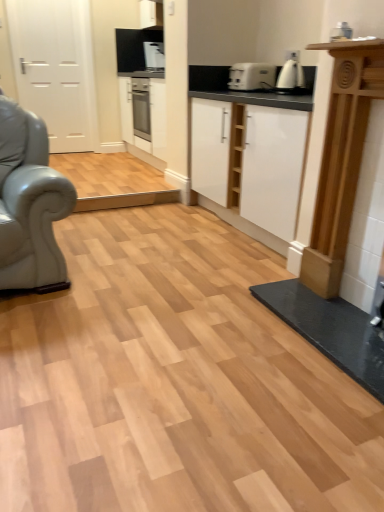
Question: Considering the relative sizes of white glossy kettle at upper right, the first coffee machine from the bottom, and white matte cabinet at center in the image provided, is white glossy kettle at upper right, the first coffee machine from the bottom, taller than white matte cabinet at center?

Choices:
 (A) yes
 (B) no

Answer: (B)

Question: From the image's perspective, does white glossy kettle at upper right, placed as the first coffee machine when sorted from right to left, appear lower than white matte cabinet at center?

Choices:
 (A) no
 (B) yes

Answer: (A)

Question: Is white matte cabinet at center surrounded by white glossy kettle at upper right, the first coffee machine from the bottom?

Choices:
 (A) yes
 (B) no

Answer: (B)

Question: Is white matte cabinet at center at the back of white glossy kettle at upper right, which is counted as the second coffee machine, starting from the top?

Choices:
 (A) no
 (B) yes

Answer: (A)

Question: Is white glossy kettle at upper right, which is counted as the second coffee machine, starting from the top, located outside white matte cabinet at center?

Choices:
 (A) no
 (B) yes

Answer: (B)

Question: Is point (274, 80) positioned closer to the camera than point (278, 177)?

Choices:
 (A) closer
 (B) farther

Answer: (B)

Question: Is white plastic toaster at center bigger or smaller than white matte cabinet at center?

Choices:
 (A) small
 (B) big

Answer: (A)

Question: From the image's perspective, is white plastic toaster at center positioned above or below white matte cabinet at center?

Choices:
 (A) above
 (B) below

Answer: (A)

Question: Considering the positions of white plastic toaster at center and white matte cabinet at center in the image, is white plastic toaster at center taller or shorter than white matte cabinet at center?

Choices:
 (A) short
 (B) tall

Answer: (A)

Question: Is white matte door at left in front of or behind white matte cabinet at center in the image?

Choices:
 (A) front
 (B) behind

Answer: (B)

Question: From the image's perspective, relative to white matte cabinet at center, is white matte door at left above or below?

Choices:
 (A) below
 (B) above

Answer: (B)

Question: In terms of size, does white matte door at left appear bigger or smaller than white matte cabinet at center?

Choices:
 (A) small
 (B) big

Answer: (A)

Question: From their relative heights in the image, would you say white matte door at left is taller or shorter than white matte cabinet at center?

Choices:
 (A) short
 (B) tall

Answer: (B)

Question: Is white glossy kettle at upper right, the first coffee machine from the bottom, situated inside white matte cabinet at center or outside?

Choices:
 (A) outside
 (B) inside

Answer: (A)

Question: Relative to white matte cabinet at center, is white glossy kettle at upper right, acting as the 1th coffee machine starting from the front, in front or behind?

Choices:
 (A) behind
 (B) front

Answer: (A)